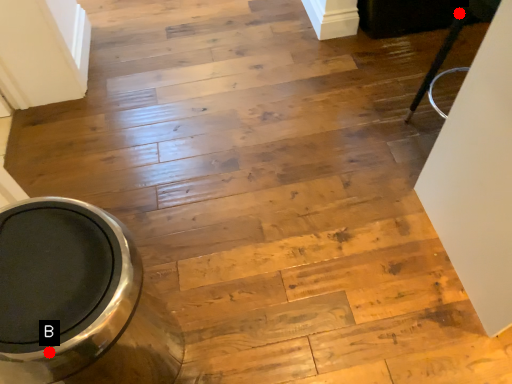
Question: Two points are circled on the image, labeled by A and B beside each circle. Among these points, which one is farthest from the camera?

Choices:
 (A) A is further
 (B) B is further

Answer: (A)